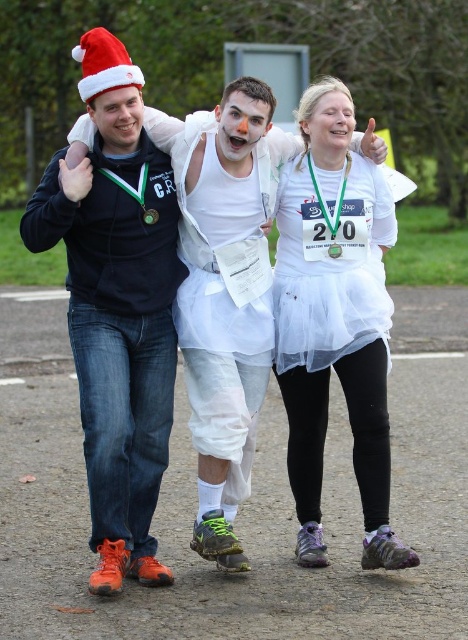
Between white matte clown nose at center and matte white face at center, which one has less height?

matte white face at center is shorter.

The height and width of the screenshot is (640, 468). Identify the location of white matte clown nose at center. (240, 129).

Does point (189, 369) come in front of point (317, 148)?

Yes, it is.

Which of these two, white matte tutu at center or smooth white face at center, stands shorter?

smooth white face at center is shorter.

This screenshot has width=468, height=640. What do you see at coordinates (220, 401) in the screenshot?
I see `white matte tutu at center` at bounding box center [220, 401].

At what (x,y) coordinates should I click in order to perform the action: click on white matte tutu at center. Please return your answer as a coordinate pair (x, y). The height and width of the screenshot is (640, 468). Looking at the image, I should click on (220, 401).

Which of these two, white tulle skirt at center or white matte clown nose at center, stands taller?

white tulle skirt at center

How much distance is there between white tulle skirt at center and white matte clown nose at center?

white tulle skirt at center is 4.28 feet from white matte clown nose at center.

The width and height of the screenshot is (468, 640). I want to click on white tulle skirt at center, so pos(335,332).